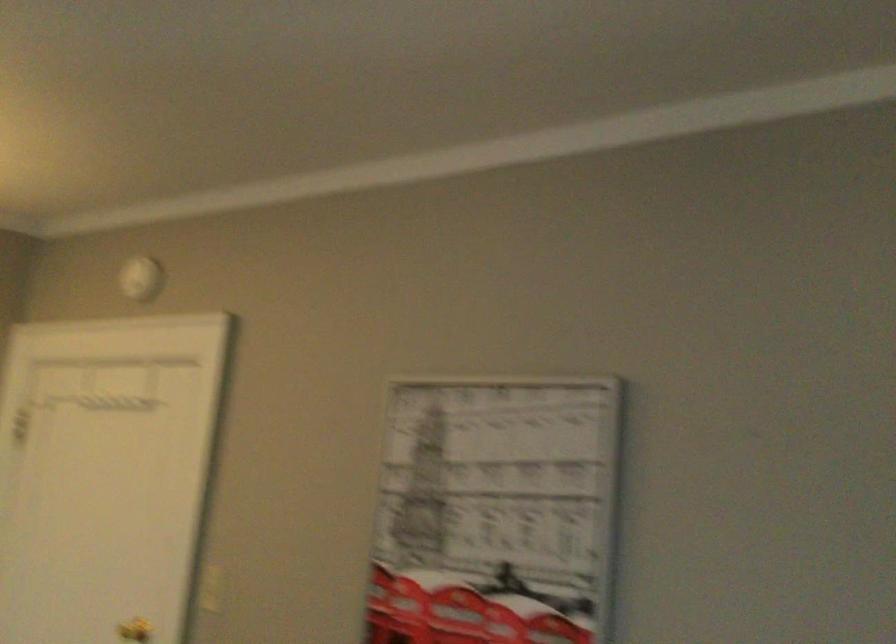
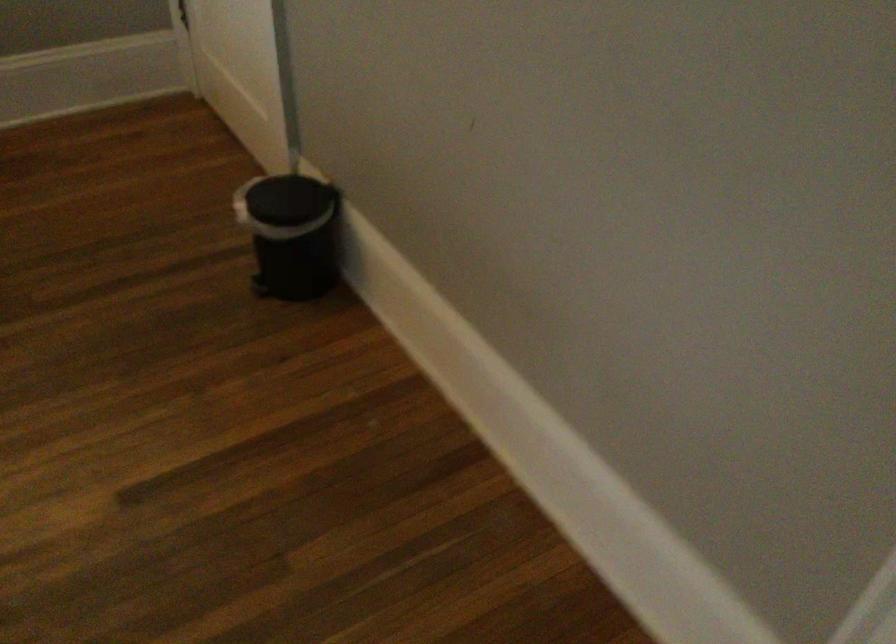
The images are taken continuously from a first-person perspective. In which direction is your viewpoint rotating?

The rotation direction of the camera is left-down.